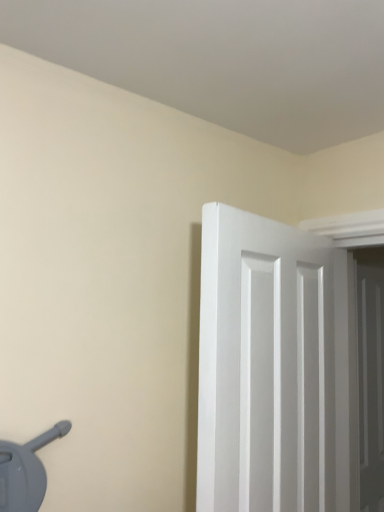
Identify the location of white smooth door at right, which is the first door from left to right. The height and width of the screenshot is (512, 384). (275, 368).

The image size is (384, 512). What do you see at coordinates (275, 368) in the screenshot? I see `white smooth door at right, the second door viewed from the right` at bounding box center [275, 368].

Locate an element on the screen. Image resolution: width=384 pixels, height=512 pixels. white wooden door at right, which is the 2th door in front-to-back order is located at coordinates (371, 376).

This screenshot has height=512, width=384. What do you see at coordinates (371, 376) in the screenshot?
I see `white wooden door at right, positioned as the first door in back-to-front order` at bounding box center [371, 376].

You are a GUI agent. You are given a task and a screenshot of the screen. Output one action in this format:
    pyautogui.click(x=<x>, y=<y>)
    Task: Click on the white smooth door at right, the second door viewed from the right
    This screenshot has height=512, width=384.
    Given the screenshot: What is the action you would take?
    pyautogui.click(x=275, y=368)

Between white wooden door at right, which is the 2th door in front-to-back order, and white smooth door at right, the second door viewed from the right, which one appears on the right side from the viewer's perspective?

white wooden door at right, which is the 2th door in front-to-back order, is more to the right.

Does white wooden door at right, the first door from the right, come in front of white smooth door at right, the second door in the back-to-front sequence?

No, white wooden door at right, the first door from the right, is behind white smooth door at right, the second door in the back-to-front sequence.

Which point is more distant from viewer, [377,500] or [347,497]?

Point [377,500]

From the image's perspective, which object appears higher, white wooden door at right, acting as the 2th door starting from the left, or white smooth door at right, the second door viewed from the right?

white smooth door at right, the second door viewed from the right.

From a real-world perspective, who is located lower, white wooden door at right, the first door from the right, or white smooth door at right, the second door viewed from the right?

From a 3D spatial view, white wooden door at right, the first door from the right, is below.

In terms of width, does white wooden door at right, which is the 2th door in front-to-back order, look wider or thinner when compared to white smooth door at right, the second door in the back-to-front sequence?

Clearly, white wooden door at right, which is the 2th door in front-to-back order, has less width compared to white smooth door at right, the second door in the back-to-front sequence.

Based on the photo, who is taller, white wooden door at right, acting as the 2th door starting from the left, or white smooth door at right, the second door viewed from the right?

Standing taller between the two is white wooden door at right, acting as the 2th door starting from the left.

Considering the sizes of white wooden door at right, acting as the 2th door starting from the left, and white smooth door at right, which is the first door from left to right, in the image, is white wooden door at right, acting as the 2th door starting from the left, bigger or smaller than white smooth door at right, which is the first door from left to right,?

white wooden door at right, acting as the 2th door starting from the left, is smaller than white smooth door at right, which is the first door from left to right.

Is white wooden door at right, which is the 2th door in front-to-back order, inside the boundaries of white smooth door at right, the first door from the front, or outside?

white wooden door at right, which is the 2th door in front-to-back order, cannot be found inside white smooth door at right, the first door from the front.

Does white wooden door at right, positioned as the first door in back-to-front order, touch white smooth door at right, the second door viewed from the right?

No, white wooden door at right, positioned as the first door in back-to-front order, is not making contact with white smooth door at right, the second door viewed from the right.

Based on the photo, could you tell me if white wooden door at right, the first door from the right, is facing white smooth door at right, the first door from the front?

No, white wooden door at right, the first door from the right, is not turned towards white smooth door at right, the first door from the front.

What's the angular difference between white wooden door at right, which is the 2th door in front-to-back order, and white smooth door at right, the second door in the back-to-front sequence,'s facing directions?

15.9 degrees separate the facing orientations of white wooden door at right, which is the 2th door in front-to-back order, and white smooth door at right, the second door in the back-to-front sequence.

The height and width of the screenshot is (512, 384). I want to click on door below the white smooth door at right, the first door from the front (from a real-world perspective), so 371,376.

Which is more to the right, white smooth door at right, the second door in the back-to-front sequence, or white wooden door at right, which is the 2th door in front-to-back order?

Positioned to the right is white wooden door at right, which is the 2th door in front-to-back order.

Is the depth of white smooth door at right, the second door viewed from the right, less than that of white wooden door at right, the first door from the right?

Yes.

Does point (226, 208) lie behind point (362, 367)?

No, it is not.

Consider the image. From the image's perspective, which one is positioned lower, white smooth door at right, the second door viewed from the right, or white wooden door at right, acting as the 2th door starting from the left?

white wooden door at right, acting as the 2th door starting from the left, from the image's perspective.

From a real-world perspective, is white smooth door at right, the second door in the back-to-front sequence, positioned under white wooden door at right, positioned as the first door in back-to-front order, based on gravity?

Actually, white smooth door at right, the second door in the back-to-front sequence, is physically above white wooden door at right, positioned as the first door in back-to-front order, in the real world.

Which of these two, white smooth door at right, the second door viewed from the right, or white wooden door at right, acting as the 2th door starting from the left, is wider?

white smooth door at right, the second door viewed from the right, is wider.

Which of these two, white smooth door at right, which is the first door from left to right, or white wooden door at right, positioned as the first door in back-to-front order, stands taller?

white wooden door at right, positioned as the first door in back-to-front order, is taller.

Considering the relative sizes of white smooth door at right, the second door viewed from the right, and white wooden door at right, the first door from the right, in the image provided, is white smooth door at right, the second door viewed from the right, smaller than white wooden door at right, the first door from the right,?

Incorrect, white smooth door at right, the second door viewed from the right, is not smaller in size than white wooden door at right, the first door from the right.

Consider the image. Does white smooth door at right, the second door viewed from the right, contain white wooden door at right, the first door from the right?

Actually, white wooden door at right, the first door from the right, is outside white smooth door at right, the second door viewed from the right.

Can you see white smooth door at right, the first door from the front, touching white wooden door at right, acting as the 2th door starting from the left?

No, white smooth door at right, the first door from the front, is not making contact with white wooden door at right, acting as the 2th door starting from the left.

Is white smooth door at right, which is the first door from left to right, looking in the opposite direction of white wooden door at right, acting as the 2th door starting from the left?

white smooth door at right, which is the first door from left to right, is not turned away from white wooden door at right, acting as the 2th door starting from the left.

How different are the orientations of white smooth door at right, which is the first door from left to right, and white wooden door at right, acting as the 2th door starting from the left, in degrees?

There is a 15.9-degree angle between the facing directions of white smooth door at right, which is the first door from left to right, and white wooden door at right, acting as the 2th door starting from the left.

Measure the distance between white smooth door at right, the second door in the back-to-front sequence, and white wooden door at right, acting as the 2th door starting from the left.

A distance of 75.26 centimeters exists between white smooth door at right, the second door in the back-to-front sequence, and white wooden door at right, acting as the 2th door starting from the left.

This screenshot has width=384, height=512. Find the location of `door above the white wooden door at right, positioned as the first door in back-to-front order (from the image's perspective)`. door above the white wooden door at right, positioned as the first door in back-to-front order (from the image's perspective) is located at coordinates (275, 368).

This screenshot has height=512, width=384. I want to click on door on the right of white smooth door at right, which is the first door from left to right, so click(x=371, y=376).

Locate an element on the screen. The width and height of the screenshot is (384, 512). door on the left of white wooden door at right, acting as the 2th door starting from the left is located at coordinates (275, 368).